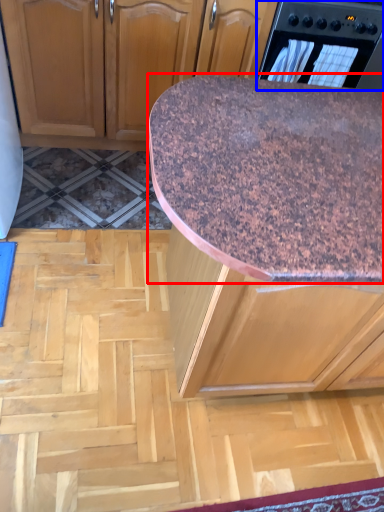
Question: Which of the following is the closest to the observer, countertop (highlighted by a red box) or home appliance (highlighted by a blue box)?

Choices:
 (A) countertop
 (B) home appliance

Answer: (A)